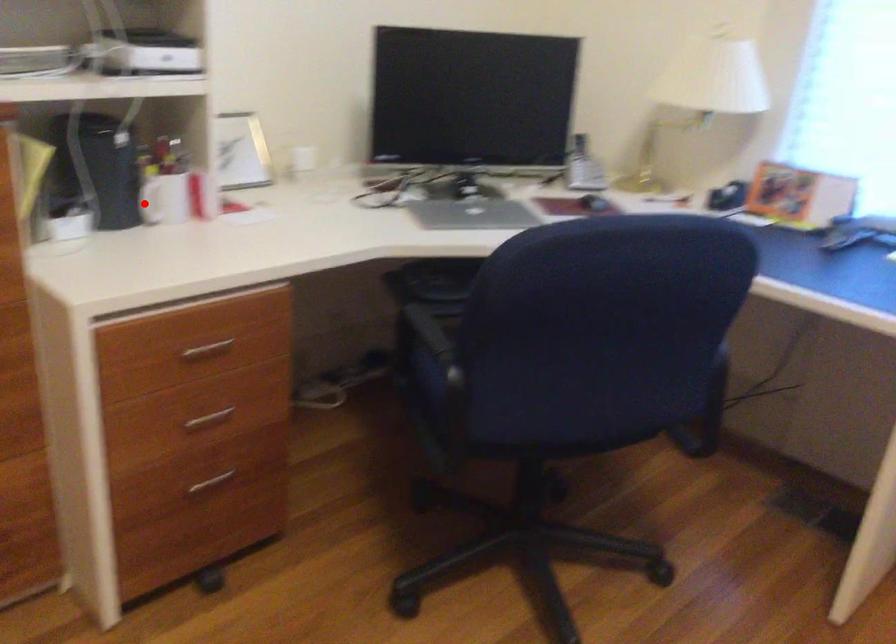
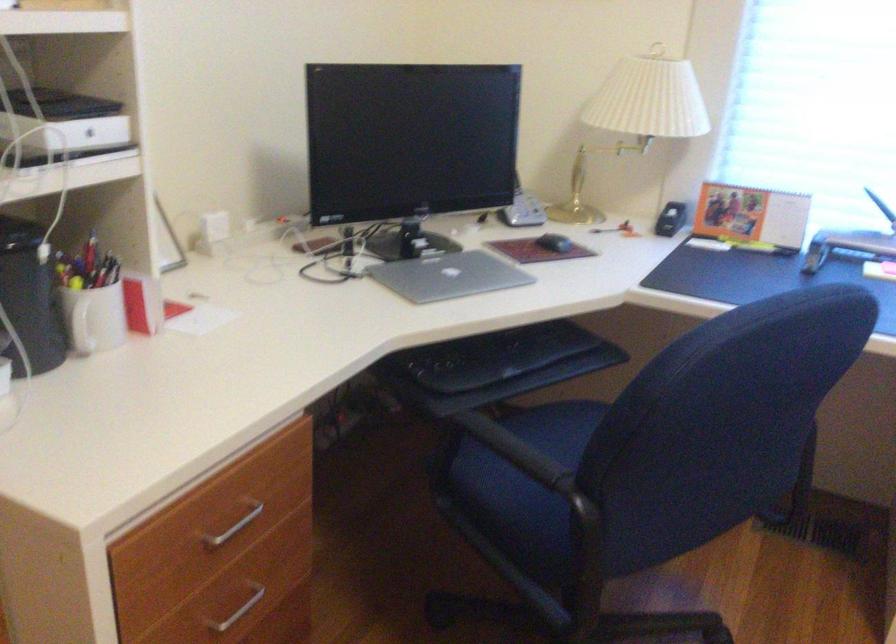
Question: A red point is marked in image1. In image2, is the corresponding 3D point closer to the camera or farther? Reply with the corresponding letter.

Choices:
 (A) The corresponding 3D point is closer.
 (B) The corresponding 3D point is farther.

Answer: (A)